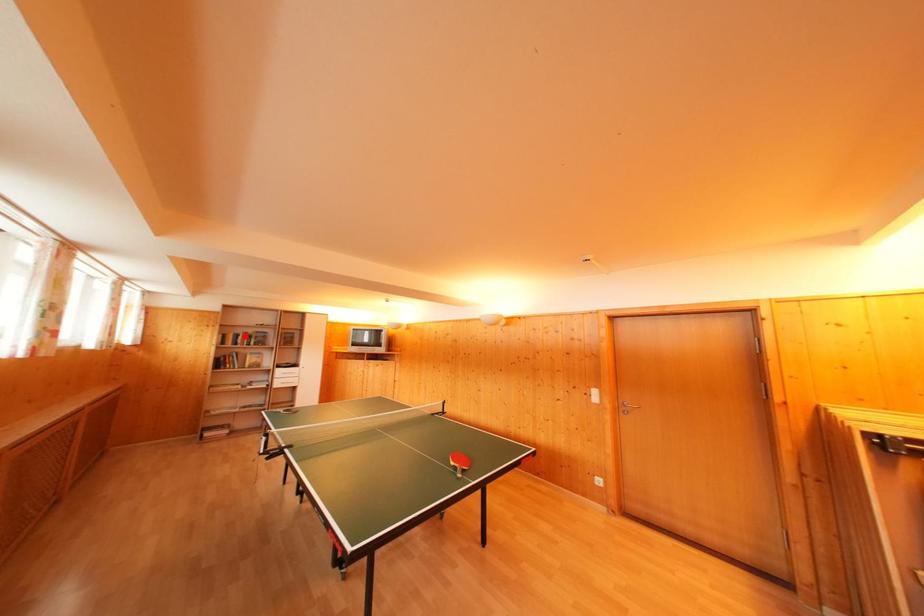
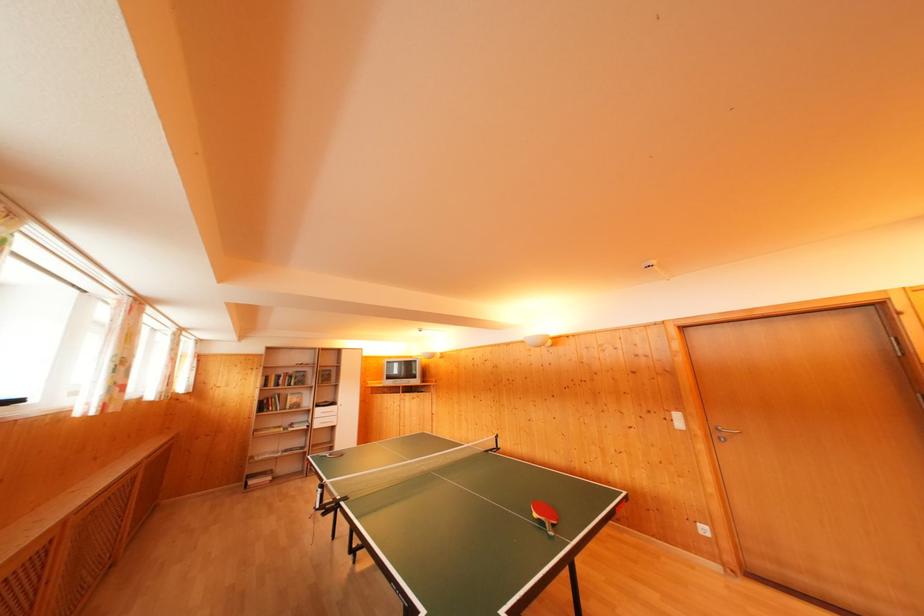
Find the pixel in the second image that matches the highlighted location in the first image.

(286, 377)